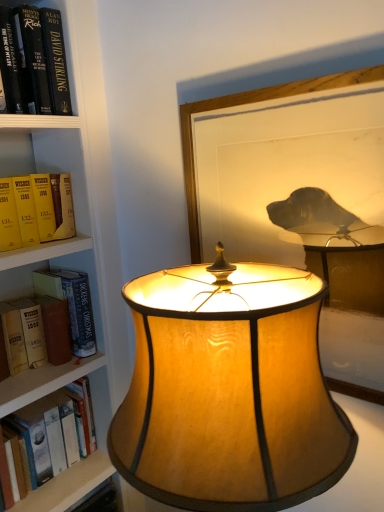
Question: Does wooden framed picture at center have a lesser height compared to hardcover book at left?

Choices:
 (A) no
 (B) yes

Answer: (A)

Question: Is wooden framed picture at center outside of hardcover book at left?

Choices:
 (A) no
 (B) yes

Answer: (B)

Question: Is wooden framed picture at center looking in the opposite direction of hardcover book at left?

Choices:
 (A) no
 (B) yes

Answer: (A)

Question: Can you confirm if wooden framed picture at center is taller than hardcover book at left?

Choices:
 (A) no
 (B) yes

Answer: (B)

Question: Does wooden framed picture at center have a smaller size compared to hardcover book at left?

Choices:
 (A) no
 (B) yes

Answer: (A)

Question: Is hardcover book at left wider or thinner than matte gold lampshade at center?

Choices:
 (A) wide
 (B) thin

Answer: (B)

Question: Is hardcover book at left situated inside matte gold lampshade at center or outside?

Choices:
 (A) outside
 (B) inside

Answer: (A)

Question: Is hardcover book at left taller or shorter than matte gold lampshade at center?

Choices:
 (A) short
 (B) tall

Answer: (A)

Question: Is hardcover book at left to the left or to the right of matte gold lampshade at center in the image?

Choices:
 (A) left
 (B) right

Answer: (A)

Question: Relative to hardcover book at left, is wooden framed picture at center in front or behind?

Choices:
 (A) front
 (B) behind

Answer: (A)

Question: Is wooden framed picture at center to the left or to the right of hardcover book at left in the image?

Choices:
 (A) right
 (B) left

Answer: (A)

Question: Looking at their shapes, would you say wooden framed picture at center is wider or thinner than hardcover book at left?

Choices:
 (A) thin
 (B) wide

Answer: (A)

Question: Do you think wooden framed picture at center is within hardcover book at left, or outside of it?

Choices:
 (A) inside
 (B) outside

Answer: (B)

Question: Considering the positions of point (69, 310) and point (319, 365), is point (69, 310) closer or farther from the camera than point (319, 365)?

Choices:
 (A) closer
 (B) farther

Answer: (B)

Question: Is hardcover book at left inside the boundaries of matte gold lampshade at center, or outside?

Choices:
 (A) outside
 (B) inside

Answer: (A)